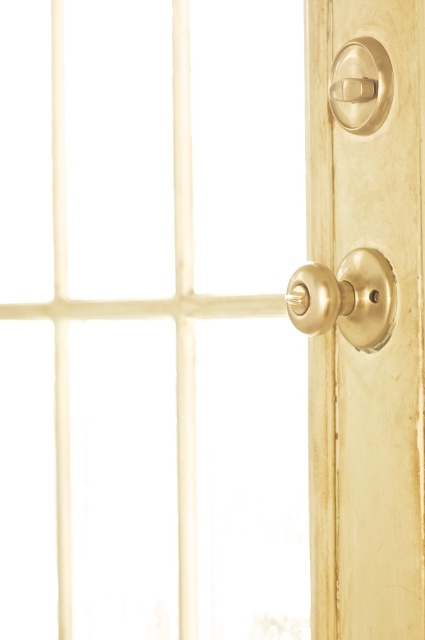
You are standing in front of a door and need to locate the brass knob at right and the polished brass knob at upper right. Which one is positioned further to the right?

The brass knob at right is positioned further to the right compared to the polished brass knob at upper right.

You are examining the door hardware and notice two points marked on the door. The first point is at coordinates point [308,298], and the second is at point [336,81]. Which of these points is closer to you as you face the door?

Point [308,298] is closer to the viewer than point [336,81].

In the scene shown: You are trying to open the door and notice two knobs. The brass knob at right and the gold polished knob at center right. Which one should you turn to open the door?

The brass knob at right is larger in size than the gold polished knob at center right, so you should turn the brass knob at right to open the door since it is typically the one used for opening.